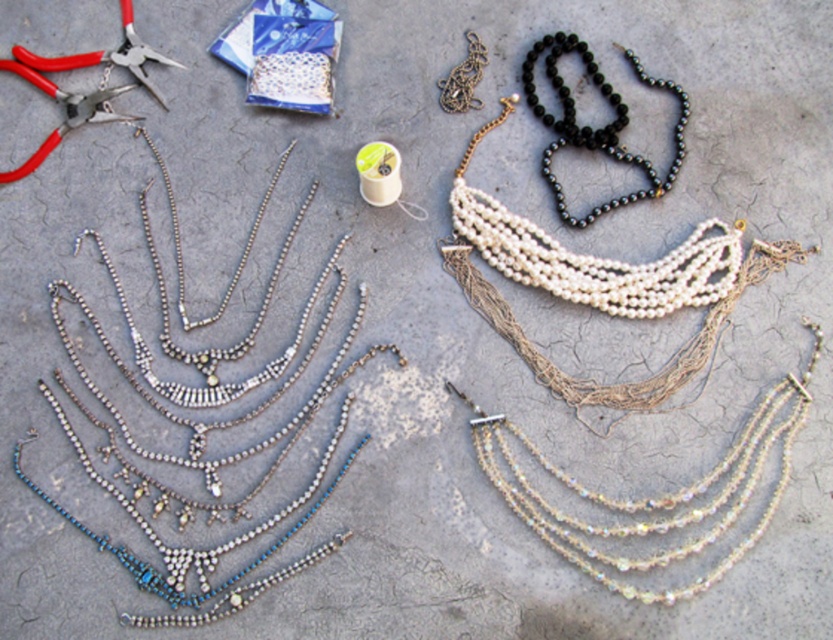
You are a customer at a jewelry store and want to examine the iridescent glass necklace at center and the black beads necklace at upper center. Which one can you see more clearly from your current position?

The iridescent glass necklace at center is closer to the viewer than the black beads necklace at upper center, so you can see the iridescent glass necklace at center more clearly.

You are a jeweler who needs to place the white pearl necklace at upper center and the red plastic pliers at upper left into a display case. The display case has a height limit of 15 cm. Can both items fit vertically without bending or damaging them?

The white pearl necklace at upper center is much taller than the red plastic pliers at upper left. However, the exact height of the white pearl necklace is not provided. If its height exceeds 15 cm, it won